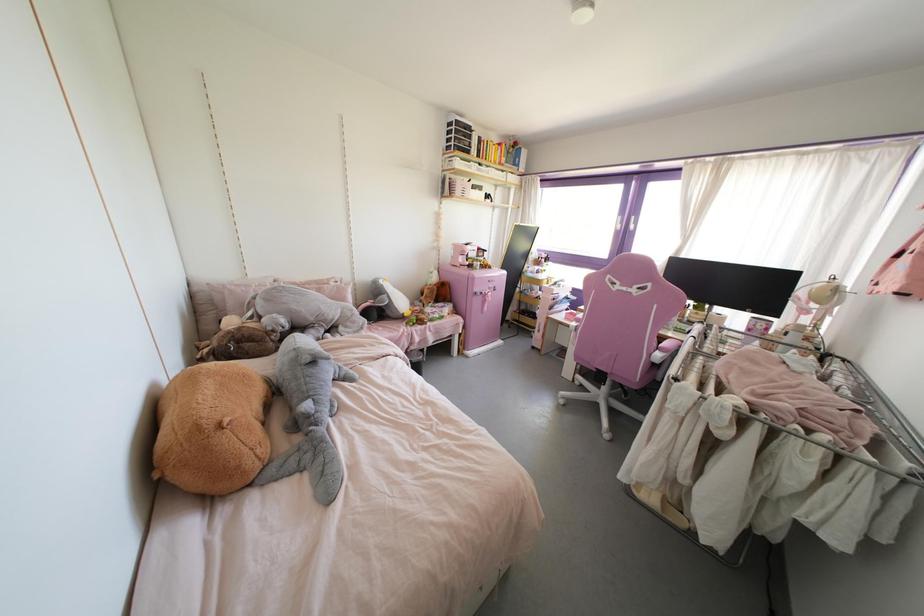
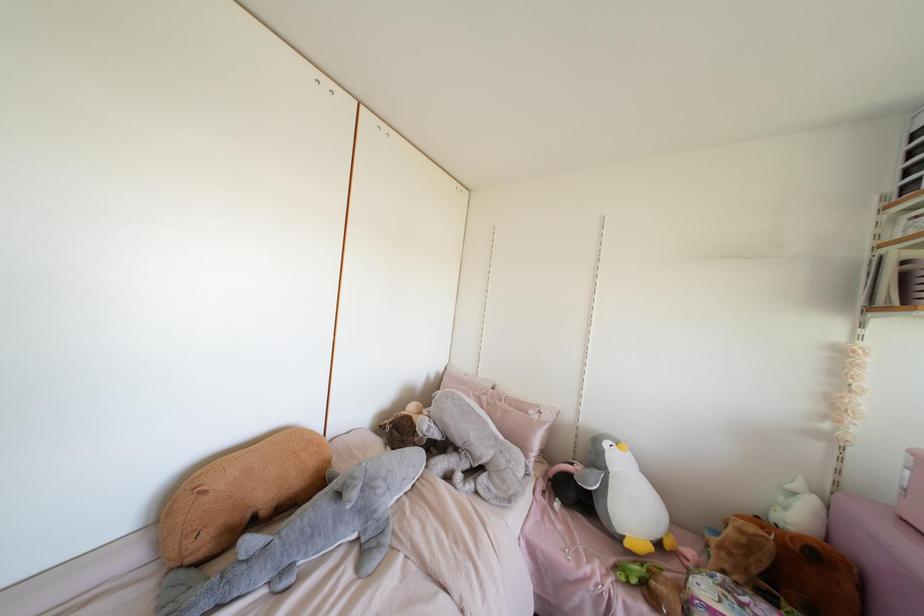
The point at (429, 288) is marked in the first image. Where is the corresponding point in the second image?

(739, 531)